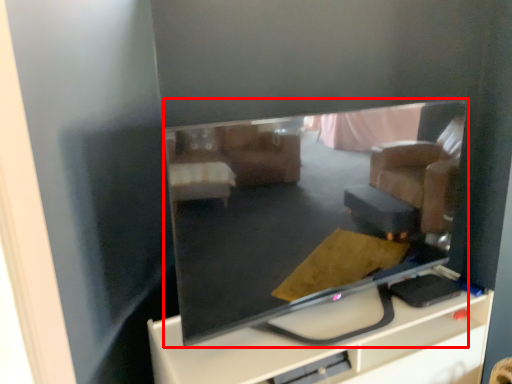
Question: From the image's perspective, considering the relative positions of television (annotated by the red box) and furniture in the image provided, where is television (annotated by the red box) located with respect to the staircase?

Choices:
 (A) above
 (B) below

Answer: (A)